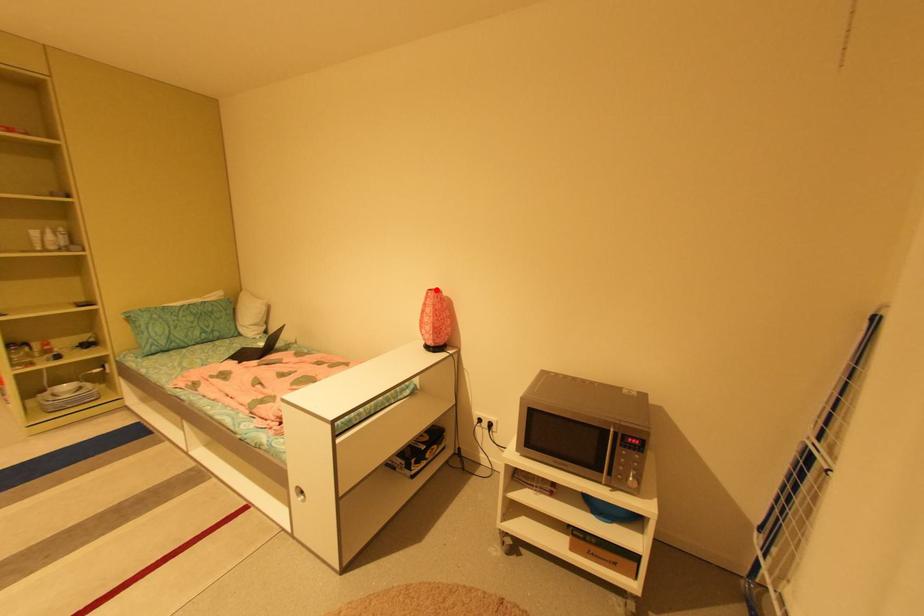
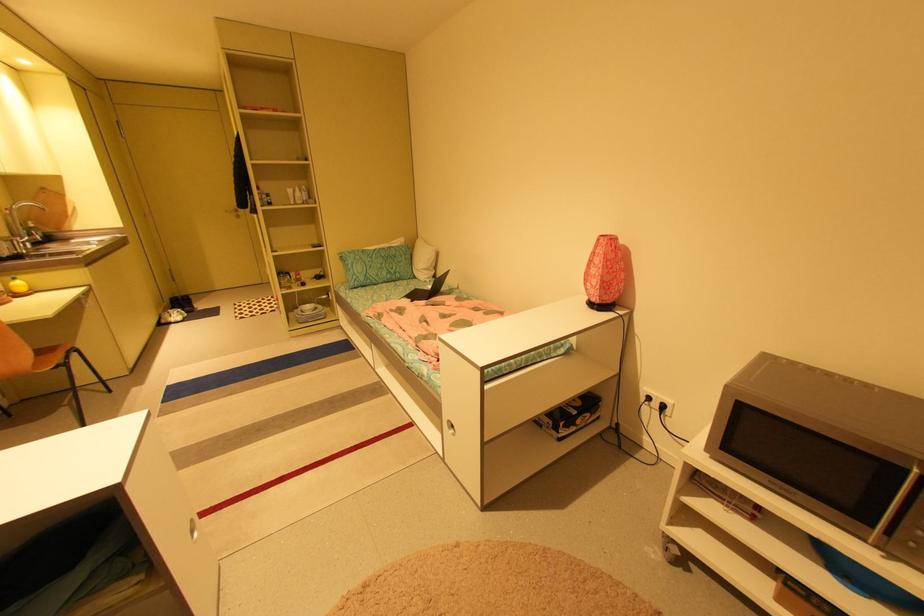
Find the pixel in the second image that matches the highlighted location in the first image.

(608, 236)